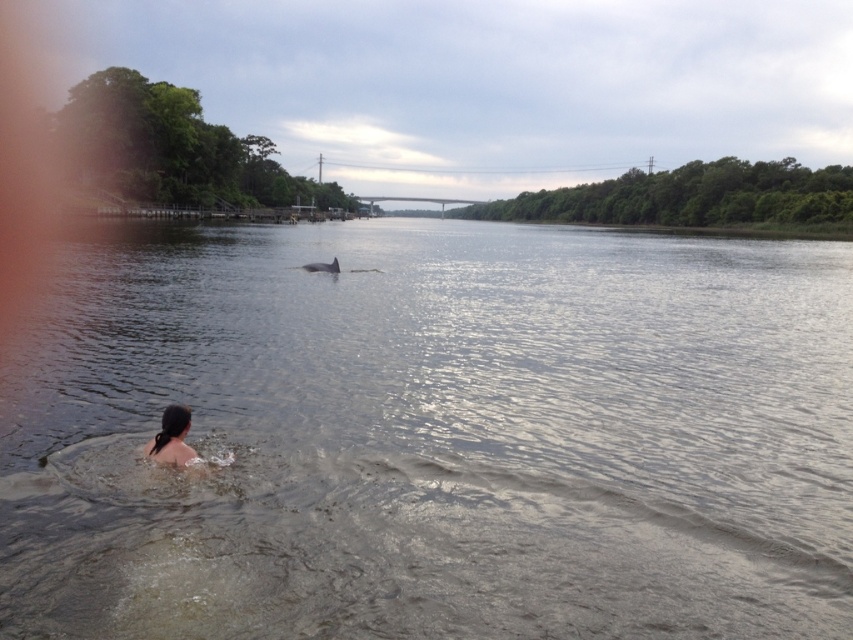
Who is higher up, clear water at center or dark hair at lower left?

Positioned higher is clear water at center.

From the picture: Is clear water at center to the right of dark hair at lower left from the viewer's perspective?

Correct, you'll find clear water at center to the right of dark hair at lower left.

Does point (21, 538) lie in front of point (163, 429)?

That is True.

This screenshot has height=640, width=853. What are the coordinates of `clear water at center` in the screenshot? It's located at (434, 436).